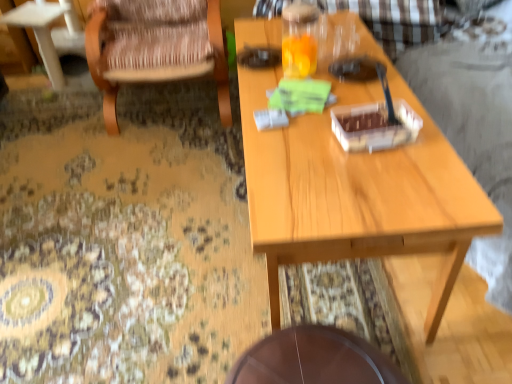
Question: Is light wood table at center wider than wooden coffee table at left?

Choices:
 (A) no
 (B) yes

Answer: (A)

Question: Is there a large distance between light wood table at center and wooden coffee table at left?

Choices:
 (A) yes
 (B) no

Answer: (A)

Question: Is light wood table at center with wooden coffee table at left?

Choices:
 (A) yes
 (B) no

Answer: (B)

Question: Can you confirm if light wood table at center is thinner than wooden coffee table at left?

Choices:
 (A) yes
 (B) no

Answer: (A)

Question: Can you confirm if light wood table at center is bigger than wooden coffee table at left?

Choices:
 (A) no
 (B) yes

Answer: (B)

Question: Looking at the image, does light wood table at center seem bigger or smaller compared to wooden coffee table at left?

Choices:
 (A) big
 (B) small

Answer: (A)

Question: In the image, is light wood table at center positioned in front of or behind wooden coffee table at left?

Choices:
 (A) behind
 (B) front

Answer: (B)

Question: From the image's perspective, is light wood table at center positioned above or below wooden coffee table at left?

Choices:
 (A) below
 (B) above

Answer: (A)

Question: In terms of width, does light wood table at center look wider or thinner when compared to wooden coffee table at left?

Choices:
 (A) thin
 (B) wide

Answer: (A)

Question: From the image's perspective, relative to wooden coffee table at left, is brown wooden table at lower center above or below?

Choices:
 (A) above
 (B) below

Answer: (B)

Question: Considering the positions of point (263, 380) and point (67, 4), is point (263, 380) closer or farther from the camera than point (67, 4)?

Choices:
 (A) closer
 (B) farther

Answer: (A)

Question: From their relative heights in the image, would you say brown wooden table at lower center is taller or shorter than wooden coffee table at left?

Choices:
 (A) short
 (B) tall

Answer: (A)

Question: From a real-world perspective, is brown wooden table at lower center physically located above or below wooden coffee table at left?

Choices:
 (A) above
 (B) below

Answer: (B)

Question: Is wooden coffee table at left in front of or behind wooden woven chair at left in the image?

Choices:
 (A) behind
 (B) front

Answer: (A)

Question: Considering the positions of wooden coffee table at left and wooden woven chair at left in the image, is wooden coffee table at left taller or shorter than wooden woven chair at left?

Choices:
 (A) tall
 (B) short

Answer: (B)